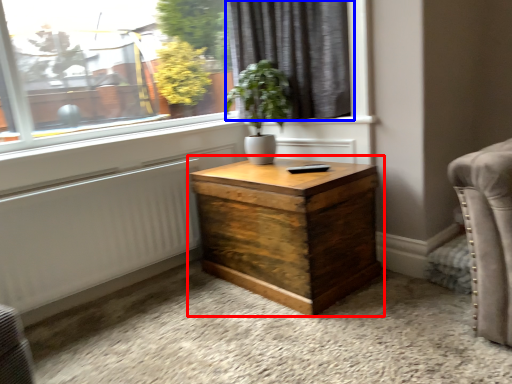
Question: Among these objects, which one is nearest to the camera, nightstand (highlighted by a red box) or curtain (highlighted by a blue box)?

Choices:
 (A) nightstand
 (B) curtain

Answer: (A)